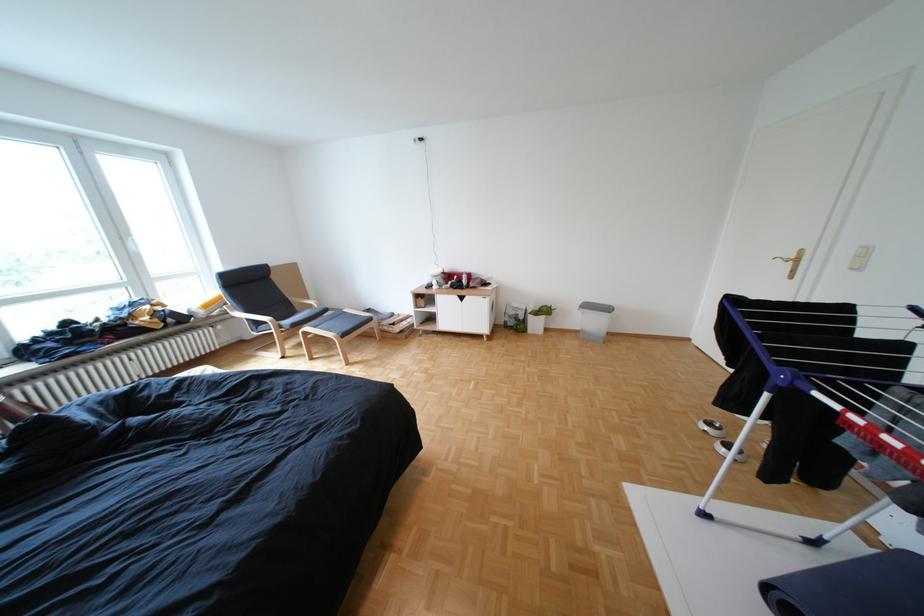
The location [466,278] corresponds to which object?

This point indicates the red bottle.